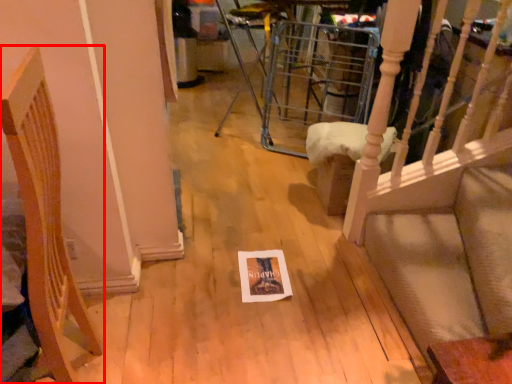
Question: From the image's perspective, what is the correct spatial relationship of furniture (annotated by the red box) in relation to furniture?

Choices:
 (A) above
 (B) below

Answer: (B)